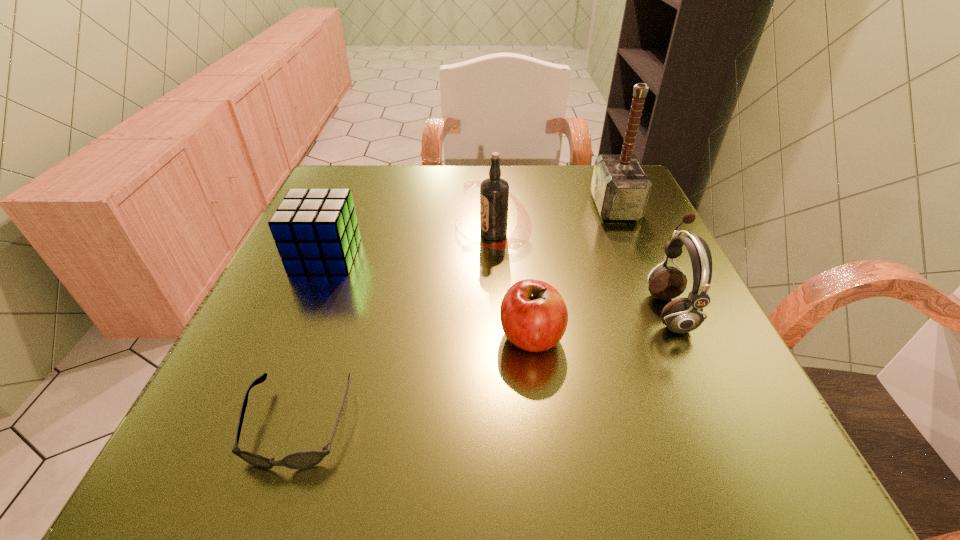
Locate an element on the screen. This screenshot has width=960, height=540. vacant space at the near left corner of the desktop is located at coordinates (268, 443).

In the image, there is a desktop. At what (x,y) coordinates should I click in order to perform the action: click on vacant space at the near right corner. Please return your answer as a coordinate pair (x, y). Looking at the image, I should click on (754, 427).

At what (x,y) coordinates should I click in order to perform the action: click on vacant area that lies between the root beer and the hammer. Please return your answer as a coordinate pair (x, y). Looking at the image, I should click on (554, 220).

You are a GUI agent. You are given a task and a screenshot of the screen. Output one action in this format:
    pyautogui.click(x=<x>, y=<y>)
    Task: Click on the empty space that is in between the nearest object and the apple
    This screenshot has width=960, height=540.
    Given the screenshot: What is the action you would take?
    pyautogui.click(x=415, y=381)

Locate an element on the screen. This screenshot has width=960, height=540. free point between the hammer and the cube is located at coordinates (470, 231).

This screenshot has width=960, height=540. What are the coordinates of `vacant space that's between the cube and the earphone` in the screenshot? It's located at [x=497, y=284].

The height and width of the screenshot is (540, 960). I want to click on vacant area that lies between the earphone and the cube, so click(497, 284).

At what (x,y) coordinates should I click in order to perform the action: click on free spot between the apple and the shortest object. Please return your answer as a coordinate pair (x, y). This screenshot has height=540, width=960. Looking at the image, I should click on (415, 381).

In order to click on free point between the nearest object and the earphone in this screenshot , I will do `click(484, 368)`.

You are a GUI agent. You are given a task and a screenshot of the screen. Output one action in this format:
    pyautogui.click(x=<x>, y=<y>)
    Task: Click on the free space between the apple and the root beer
    
    Given the screenshot: What is the action you would take?
    pyautogui.click(x=512, y=285)